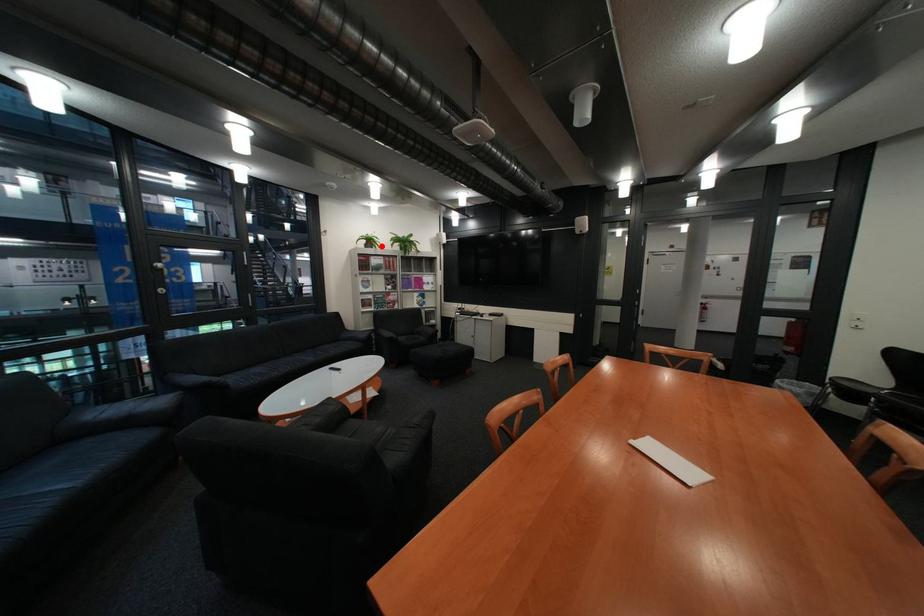
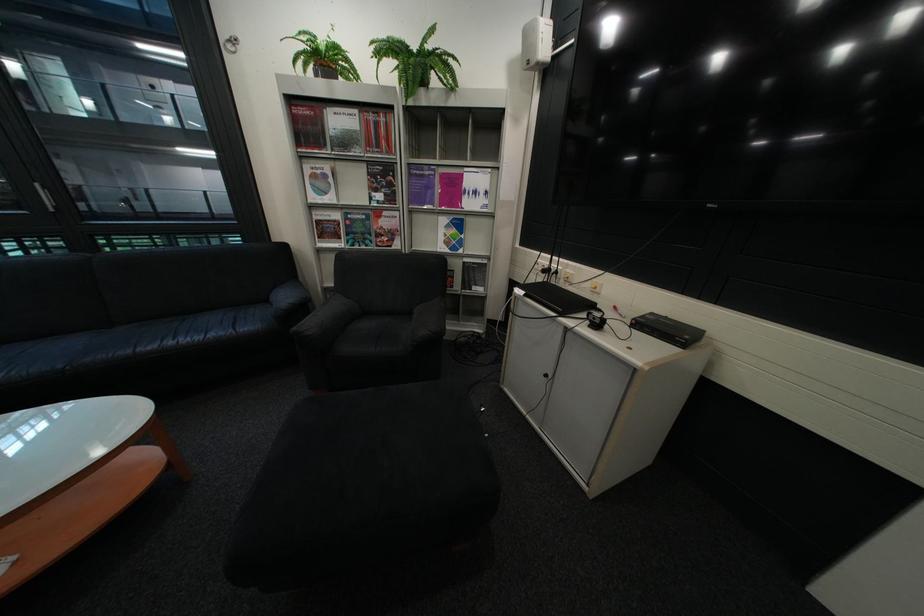
Where in the second image is the point corresponding to the highlighted location from the first image?

(333, 78)